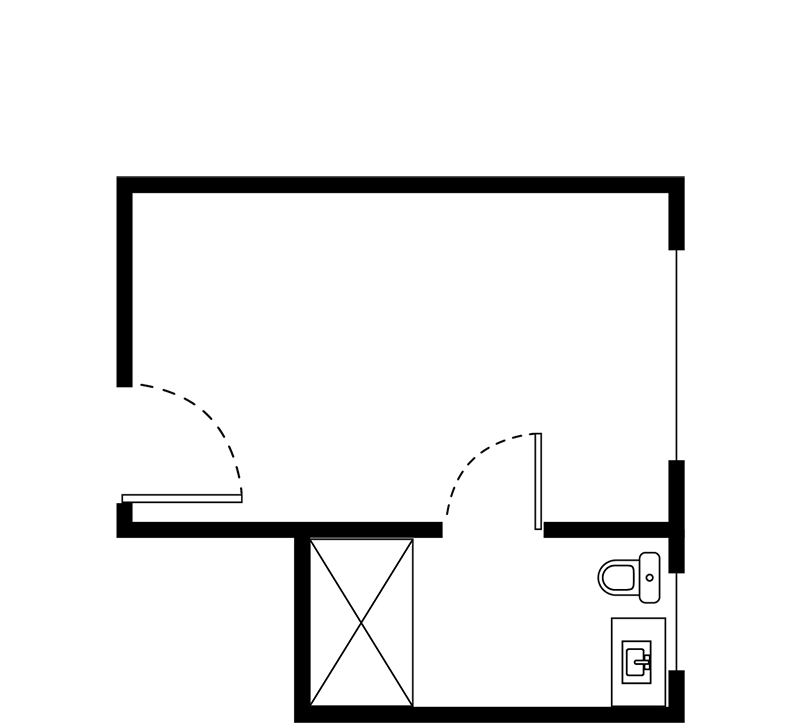
In order to click on door in this screenshot , I will do `click(201, 500)`, `click(537, 482)`.